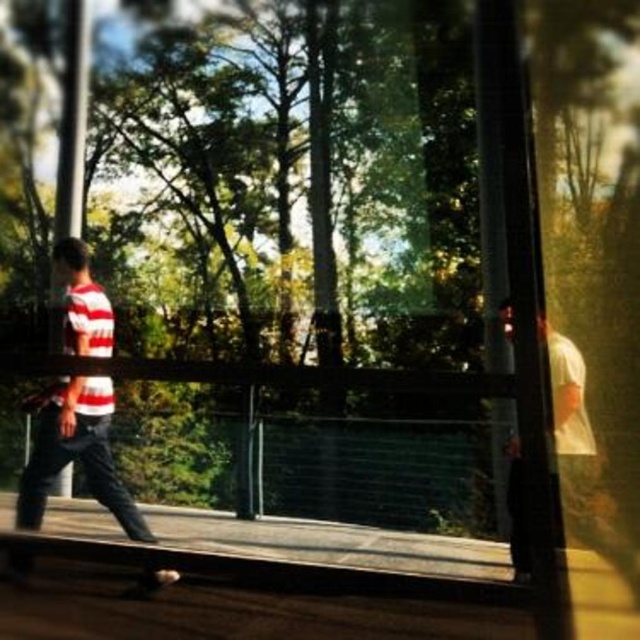
Question: Which of the following is the farthest from the observer?

Choices:
 (A) (32, 524)
 (B) (26, 570)

Answer: (A)

Question: Is striped cotton shirt at left thinner than smooth black skateboard at lower center?

Choices:
 (A) yes
 (B) no

Answer: (B)

Question: Which point appears closest to the camera in this image?

Choices:
 (A) click(x=170, y=572)
 (B) click(x=52, y=420)

Answer: (A)

Question: Is striped cotton shirt at left further to camera compared to smooth black skateboard at lower center?

Choices:
 (A) yes
 (B) no

Answer: (A)

Question: Can you confirm if striped cotton shirt at left is smaller than smooth black skateboard at lower center?

Choices:
 (A) yes
 (B) no

Answer: (B)